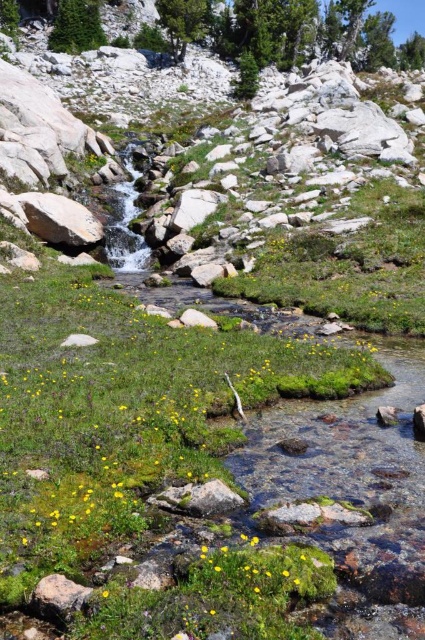
Question: Which point appears farthest from the camera in this image?

Choices:
 (A) (303, 572)
 (B) (283, 572)

Answer: (A)

Question: Does yellow matte flower at lower center appear under yellow matte flower at center?

Choices:
 (A) no
 (B) yes

Answer: (B)

Question: Can you confirm if yellow matte flower at lower center is thinner than yellow matte flower at center?

Choices:
 (A) yes
 (B) no

Answer: (B)

Question: Is yellow matte flower at lower center above yellow matte flower at center?

Choices:
 (A) no
 (B) yes

Answer: (A)

Question: Which point appears closest to the camera in this image?

Choices:
 (A) (286, 572)
 (B) (274, 545)

Answer: (A)